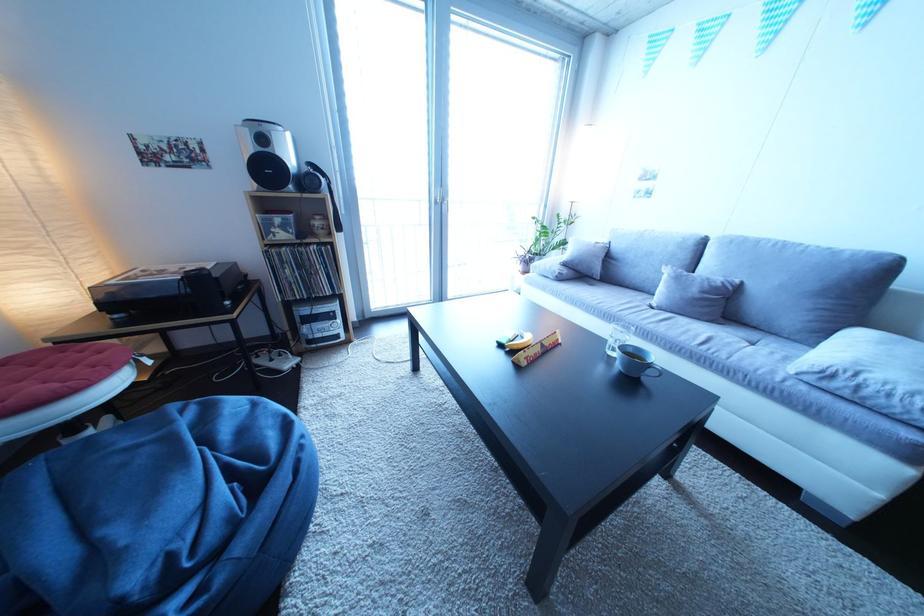
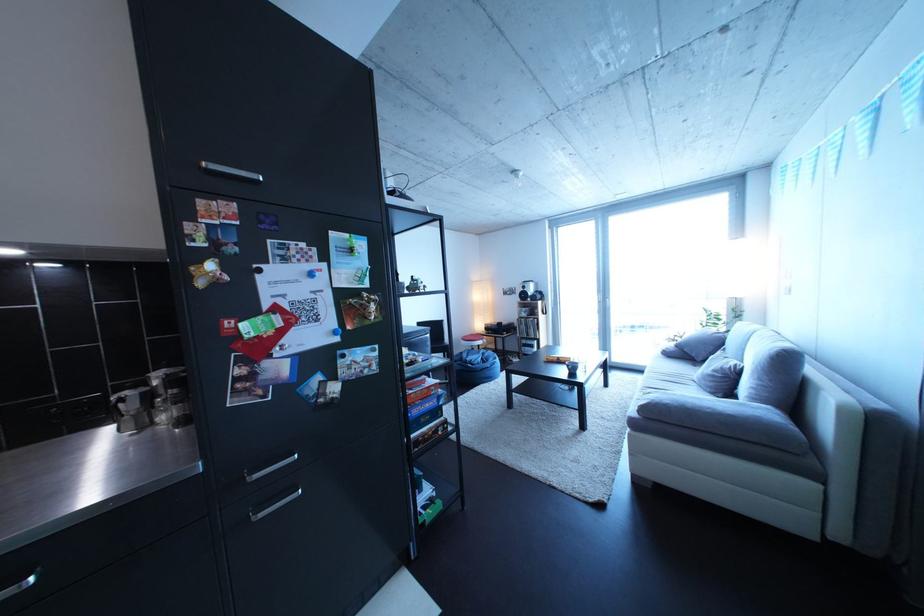
Find the pixel in the second image that matches [574,285] in the first image.

(682, 361)